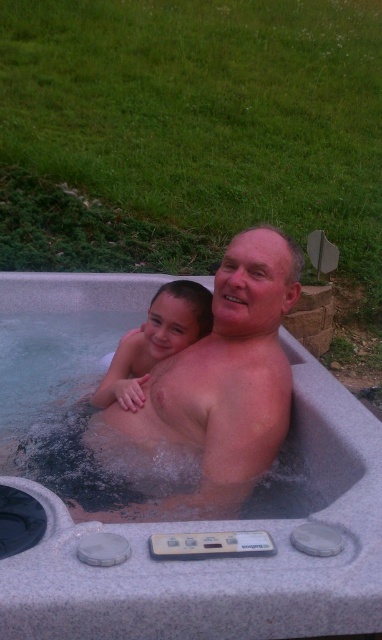
Can you confirm if smooth skin man at center is taller than smooth skin child at center?

Correct, smooth skin man at center is much taller as smooth skin child at center.

Describe the element at coordinates (221, 385) in the screenshot. I see `smooth skin man at center` at that location.

The image size is (382, 640). I want to click on smooth skin man at center, so click(x=221, y=385).

Is gray plastic hot tub at center to the left of smooth skin man at center from the viewer's perspective?

No, gray plastic hot tub at center is not to the left of smooth skin man at center.

Describe the element at coordinates (224, 560) in the screenshot. The image size is (382, 640). I see `gray plastic hot tub at center` at that location.

Between point (55, 548) and point (234, 500), which one is positioned in front?

Point (55, 548)

At what (x,y) coordinates should I click in order to perform the action: click on gray plastic hot tub at center. Please return your answer as a coordinate pair (x, y). The image size is (382, 640). Looking at the image, I should click on (224, 560).

Who is positioned more to the left, gray plastic hot tub at center or smooth skin child at center?

Positioned to the left is smooth skin child at center.

Can you confirm if gray plastic hot tub at center is thinner than smooth skin child at center?

Incorrect, gray plastic hot tub at center's width is not less than smooth skin child at center's.

Does point (64, 320) come in front of point (174, 340)?

No, it is behind (174, 340).

Locate an element on the screen. This screenshot has width=382, height=640. gray plastic hot tub at center is located at coordinates (224, 560).